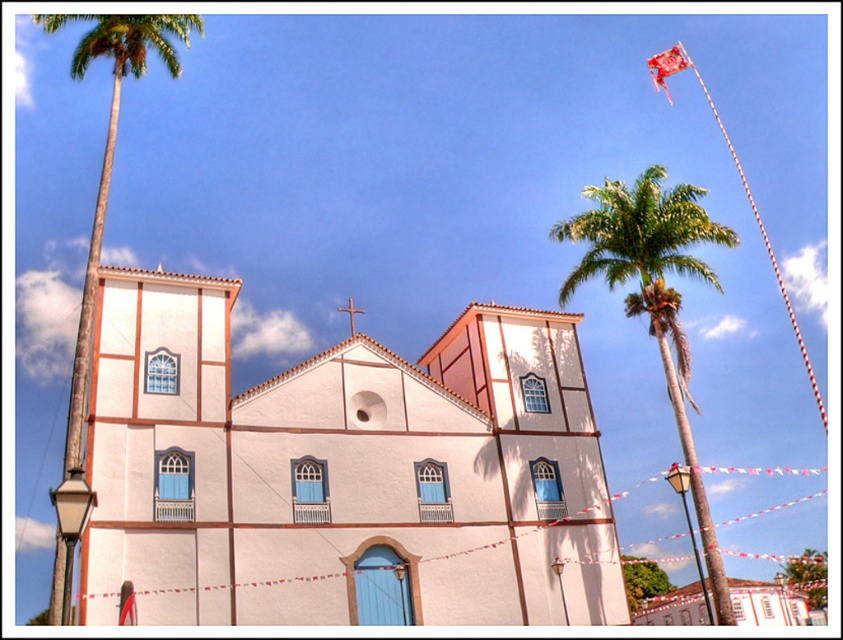
Between green leafy palm tree at right and green leafy palm tree at left, which one appears on the left side from the viewer's perspective?

Positioned to the left is green leafy palm tree at left.

Does green leafy palm tree at right appear on the right side of green leafy palm tree at left?

Indeed, green leafy palm tree at right is positioned on the right side of green leafy palm tree at left.

Describe the element at coordinates (654, 296) in the screenshot. The width and height of the screenshot is (843, 640). I see `green leafy palm tree at right` at that location.

This screenshot has height=640, width=843. Find the location of `green leafy palm tree at right`. green leafy palm tree at right is located at coordinates click(654, 296).

What do you see at coordinates (341, 472) in the screenshot? I see `white matte church at center` at bounding box center [341, 472].

Is white matte church at center to the left of green leafy palm tree at left from the viewer's perspective?

Incorrect, white matte church at center is not on the left side of green leafy palm tree at left.

What do you see at coordinates (341, 472) in the screenshot? I see `white matte church at center` at bounding box center [341, 472].

You are a GUI agent. You are given a task and a screenshot of the screen. Output one action in this format:
    pyautogui.click(x=<x>, y=<y>)
    Task: Click on the white matte church at center
    
    Given the screenshot: What is the action you would take?
    pyautogui.click(x=341, y=472)

Can you confirm if white matte church at center is positioned below green leafy palm tree at right?

Yes.

Is white matte church at center smaller than green leafy palm tree at right?

Yes, white matte church at center is smaller than green leafy palm tree at right.

What do you see at coordinates (341, 472) in the screenshot? This screenshot has height=640, width=843. I see `white matte church at center` at bounding box center [341, 472].

At what (x,y) coordinates should I click in order to perform the action: click on white matte church at center. Please return your answer as a coordinate pair (x, y). Looking at the image, I should click on (341, 472).